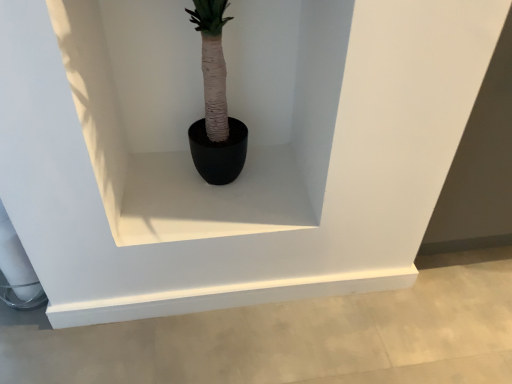
This screenshot has width=512, height=384. I want to click on vacant area situated below black matte pot at center (from a real-world perspective), so click(x=216, y=195).